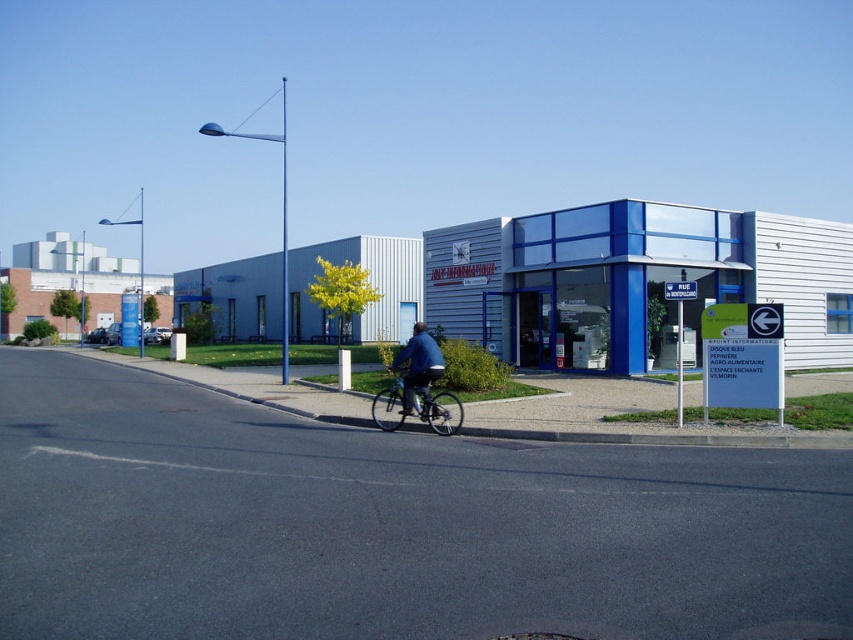
Question: Is metallic silver bicycle at center thinner than blue denim jacket at center?

Choices:
 (A) yes
 (B) no

Answer: (A)

Question: Is metallic silver bicycle at center wider than blue denim jacket at center?

Choices:
 (A) yes
 (B) no

Answer: (B)

Question: Which of the following is the closest to the observer?

Choices:
 (A) blue denim jacket at center
 (B) metallic silver bicycle at center

Answer: (A)

Question: Among these objects, which one is nearest to the camera?

Choices:
 (A) blue denim jacket at center
 (B) metallic silver bicycle at center

Answer: (A)

Question: Does metallic silver bicycle at center appear over blue denim jacket at center?

Choices:
 (A) yes
 (B) no

Answer: (B)